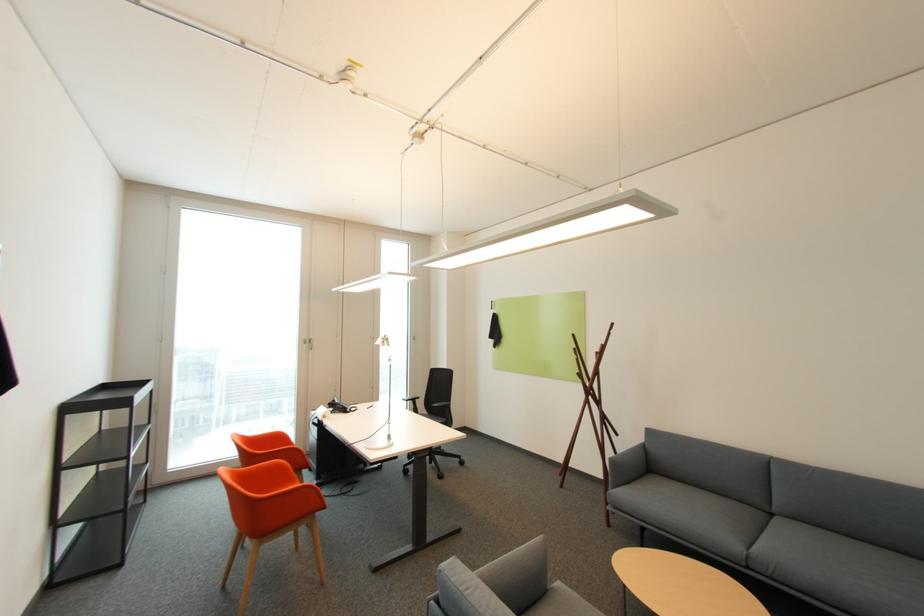
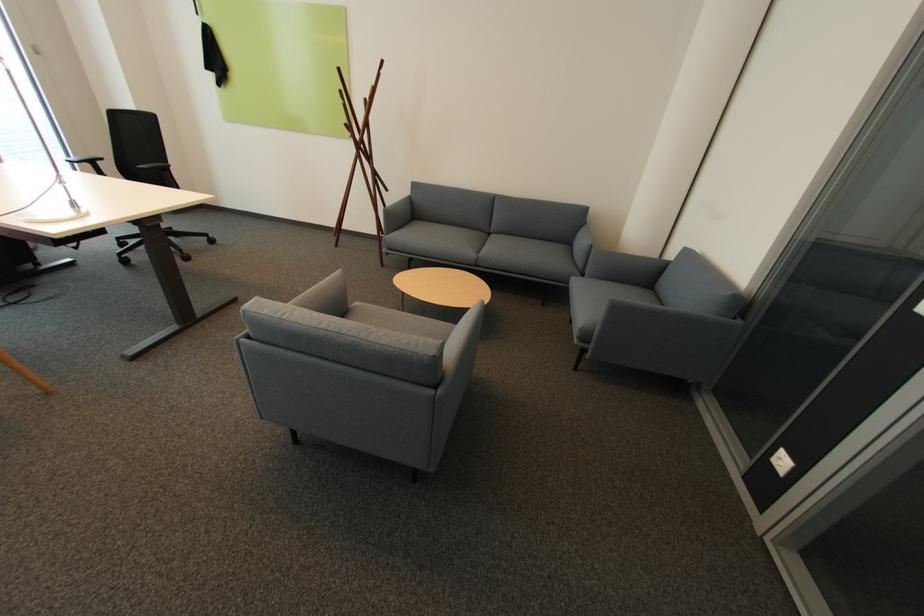
Find the pixel in the second image that matches the point at 565,585 in the first image.

(362, 304)